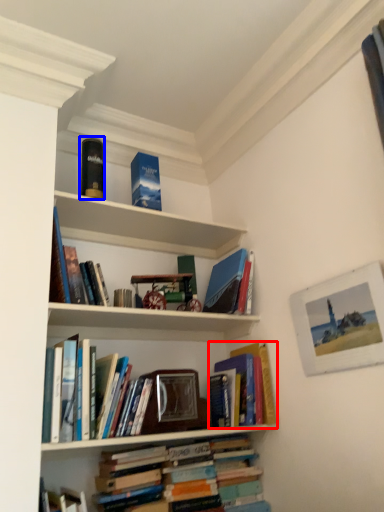
Question: Which object appears closest to the camera in this image, book (highlighted by a red box) or paperback book (highlighted by a blue box)?

Choices:
 (A) book
 (B) paperback book

Answer: (A)